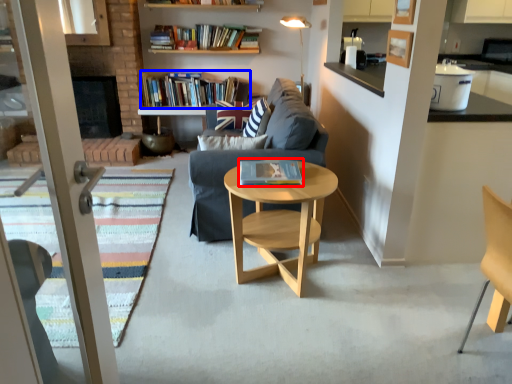
Question: Which object appears closest to the camera in this image, book (highlighted by a red box) or book (highlighted by a blue box)?

Choices:
 (A) book
 (B) book

Answer: (A)